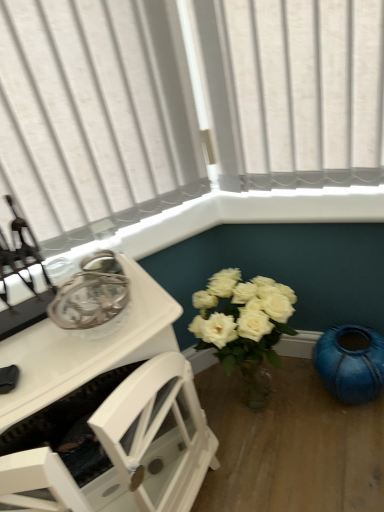
Identify the location of vacant space underneath white glossy table at upper left (from a real-world perspective). (124, 322).